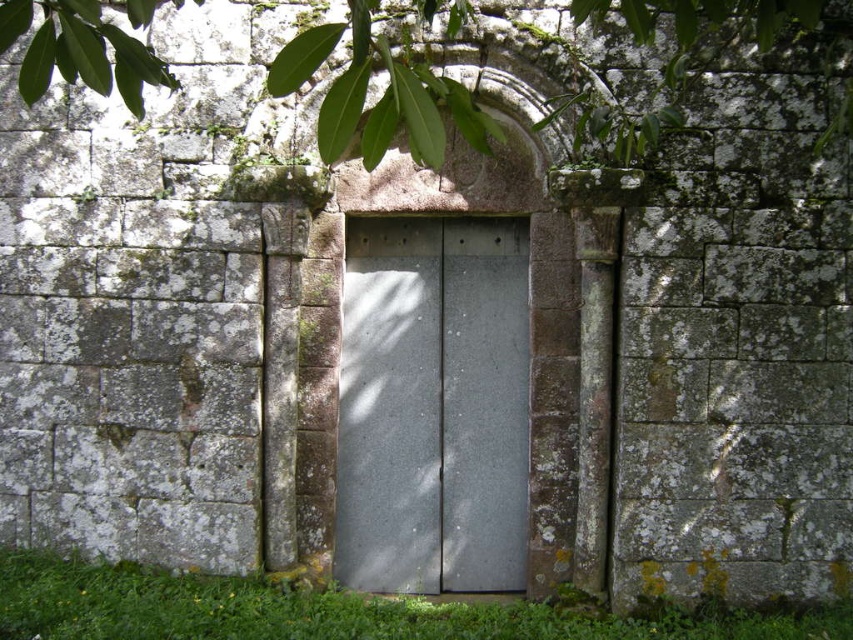
You are standing in front of an ancient stone doorway and notice a green leafy tree at upper center and green grass at bottom. Which object is positioned to the right of the other?

The green leafy tree at upper center is to the right of green grass at bottom.

You are standing in front of the ancient stone doorway and notice two green elements in the scene. Which one is taller between the green leafy tree at upper center and the green grass at bottom?

The green leafy tree at upper center is taller than the green grass at bottom.